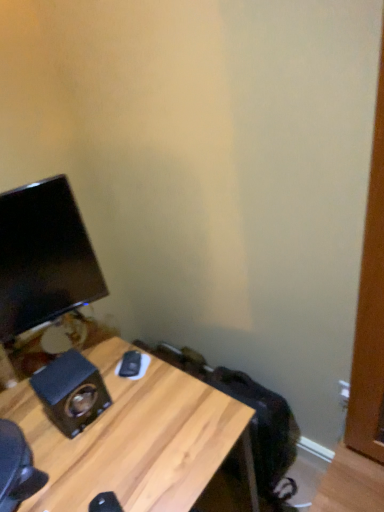
Question: Can you confirm if wooden grain speaker at lower left is wider than black glossy monitor at left?

Choices:
 (A) no
 (B) yes

Answer: (B)

Question: Is wooden grain speaker at lower left further to the viewer compared to black glossy monitor at left?

Choices:
 (A) no
 (B) yes

Answer: (B)

Question: Is wooden grain speaker at lower left looking in the opposite direction of black glossy monitor at left?

Choices:
 (A) no
 (B) yes

Answer: (A)

Question: Is wooden grain speaker at lower left shorter than black glossy monitor at left?

Choices:
 (A) yes
 (B) no

Answer: (A)

Question: Can you confirm if wooden grain speaker at lower left is taller than black glossy monitor at left?

Choices:
 (A) yes
 (B) no

Answer: (B)

Question: From their relative heights in the image, would you say wooden grain speaker at lower left is taller or shorter than wooden desk at lower left?

Choices:
 (A) short
 (B) tall

Answer: (A)

Question: From a real-world perspective, is wooden grain speaker at lower left physically located above or below wooden desk at lower left?

Choices:
 (A) below
 (B) above

Answer: (B)

Question: Does point pyautogui.click(x=89, y=366) appear closer or farther from the camera than point pyautogui.click(x=173, y=407)?

Choices:
 (A) closer
 (B) farther

Answer: (A)

Question: Is wooden grain speaker at lower left spatially inside wooden desk at lower left, or outside of it?

Choices:
 (A) outside
 (B) inside

Answer: (A)

Question: In the image, is wooden desk at lower left positioned in front of or behind wooden grain speaker at lower left?

Choices:
 (A) behind
 (B) front

Answer: (B)

Question: Based on their sizes in the image, would you say wooden desk at lower left is bigger or smaller than wooden grain speaker at lower left?

Choices:
 (A) small
 (B) big

Answer: (B)

Question: From a real-world perspective, is wooden desk at lower left physically located above or below wooden grain speaker at lower left?

Choices:
 (A) above
 (B) below

Answer: (B)

Question: Is wooden desk at lower left taller or shorter than wooden grain speaker at lower left?

Choices:
 (A) short
 (B) tall

Answer: (B)

Question: Relative to black glossy monitor at left, is wooden desk at lower left in front or behind?

Choices:
 (A) front
 (B) behind

Answer: (A)

Question: From a real-world perspective, relative to black glossy monitor at left, is wooden desk at lower left vertically above or below?

Choices:
 (A) below
 (B) above

Answer: (A)